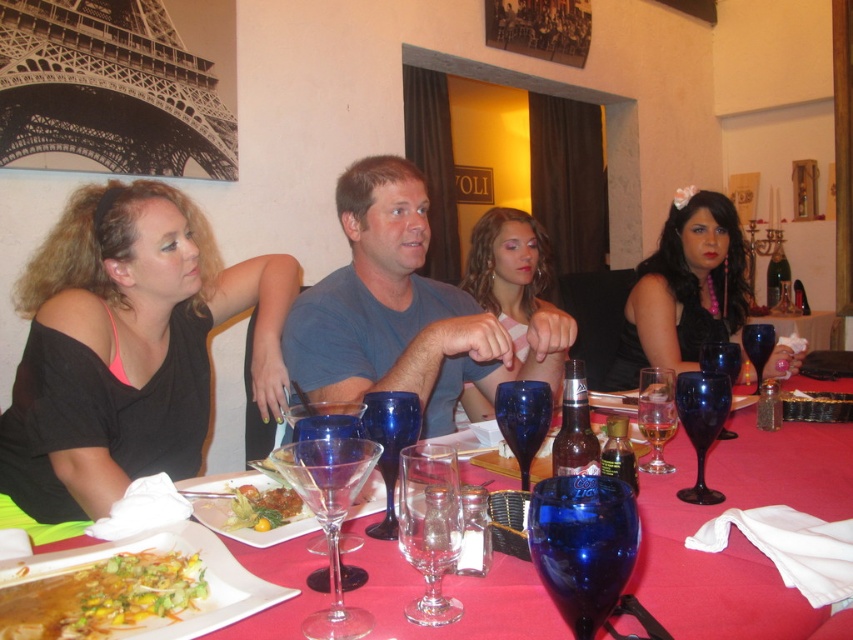
Question: In this image, where is blue matte shirt at center located relative to shiny blue glass at table center?

Choices:
 (A) left
 (B) right

Answer: (A)

Question: Which object is farther from the camera taking this photo?

Choices:
 (A) shiny blue glass at center
 (B) yellowish matte vegetable salad at center
 (C) blue glass wine at center

Answer: (C)

Question: Estimate the real-world distances between objects in this image. Which object is farther from the yellowish matte vegetable salad at center?

Choices:
 (A) transparent blue martini glass at center
 (B) matte black dress at right
 (C) transparent glass martini glass at center
 (D) shiny blue glass at table center

Answer: (B)

Question: Is matte black dress at right bigger than blue glass wine at center?

Choices:
 (A) no
 (B) yes

Answer: (B)

Question: Which object is positioned farthest from the matte black dress at right?

Choices:
 (A) black matte shirt at left
 (B) glossy blue wine glass at table center
 (C) clear glass wine glass at center

Answer: (A)

Question: Observing the image, what is the correct spatial positioning of yellowish matte vegetable salad at center in reference to transparent blue wine glass at right?

Choices:
 (A) right
 (B) left

Answer: (B)